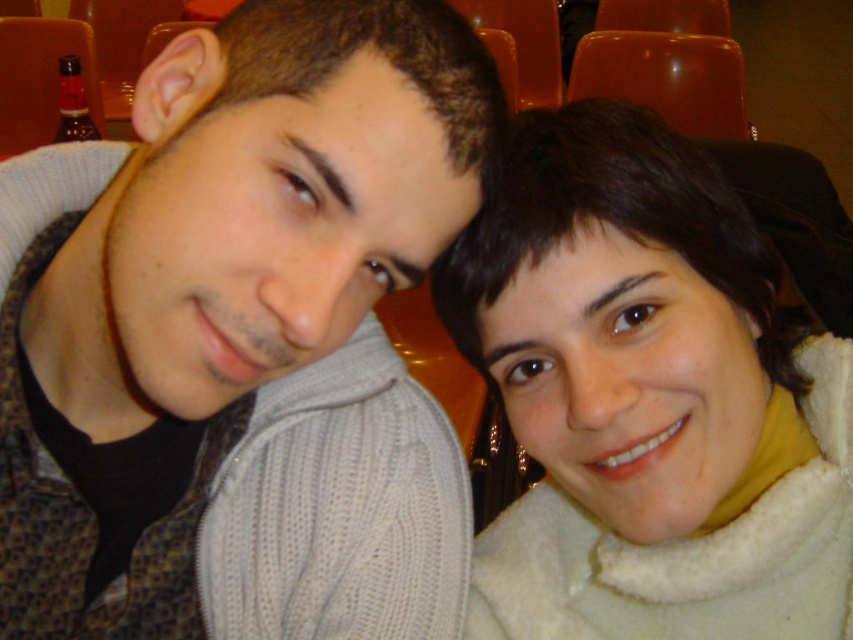
You are a photographer standing at the camera position. You want to place a small decoration at point (x=450, y=33) which is 19.49 inches away from the camera. The decoration requires a minimum of 20 inches of space to be placed safely. Can you place it there?

The distance of point (x=450, y=33) from camera is 19.49 inches, which is less than the required 20 inches. Therefore, you cannot place the decoration there safely.

You are a photographer trying to capture a closeup of the knitted sweater at center without the white fleece scarf at upper right blocking the view. Is this possible based on their positions?

The knitted sweater at center is in front of the white fleece scarf at upper right, so it is possible to capture a closeup of the knitted sweater at center without the scarf blocking the view since it is behind.

You are a photographer adjusting the camera focus. You need to ensure both the knitted sweater at center and the white fleece scarf at upper right are in focus. Given their sizes, which object should you adjust the focus to prioritize first?

The knitted sweater at center is taller than the white fleece scarf at upper right, so you should prioritize focusing on the knitted sweater at center first to ensure it is in focus before adjusting for the smaller scarf.